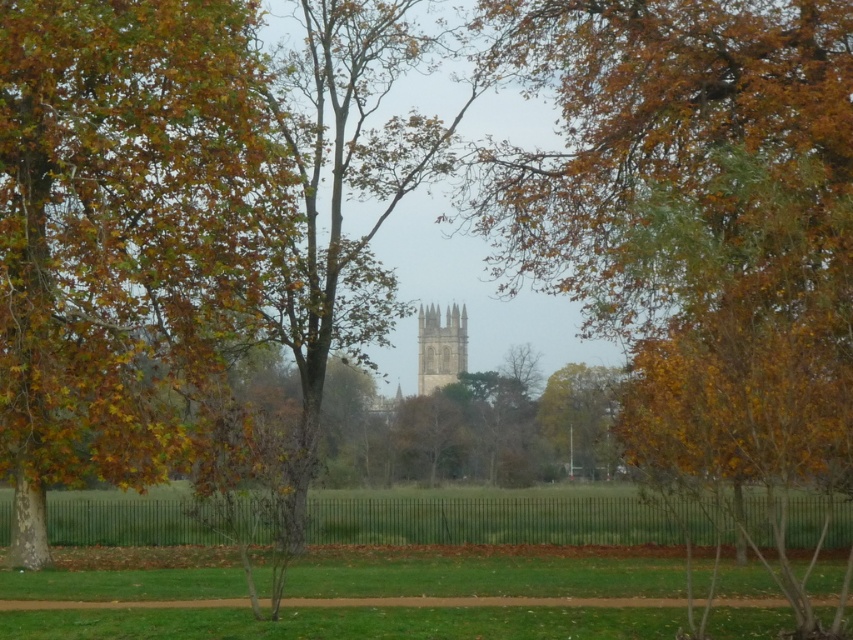
Which is above, autumn leaves at center or gray stone bell tower at center?

Positioned higher is autumn leaves at center.

Does autumn leaves at center lie behind gray stone bell tower at center?

No, it is not.

Who is more forward, (x=525, y=60) or (x=448, y=360)?

Point (x=525, y=60)

The image size is (853, 640). Find the location of `autumn leaves at center`. autumn leaves at center is located at coordinates (695, 218).

Is autumn leaves at left below brown leafy tree at center?

No, autumn leaves at left is not below brown leafy tree at center.

Who is higher up, autumn leaves at left or brown leafy tree at center?

autumn leaves at left is above.

Identify the location of autumn leaves at left. The image size is (853, 640). (120, 232).

Locate an element on the screen. The width and height of the screenshot is (853, 640). autumn leaves at left is located at coordinates (120, 232).

How much distance is there between autumn leaves at center and autumn leaves at left?

autumn leaves at center is 10.67 meters away from autumn leaves at left.

I want to click on autumn leaves at center, so click(x=695, y=218).

Image resolution: width=853 pixels, height=640 pixels. Identify the location of autumn leaves at center. (695, 218).